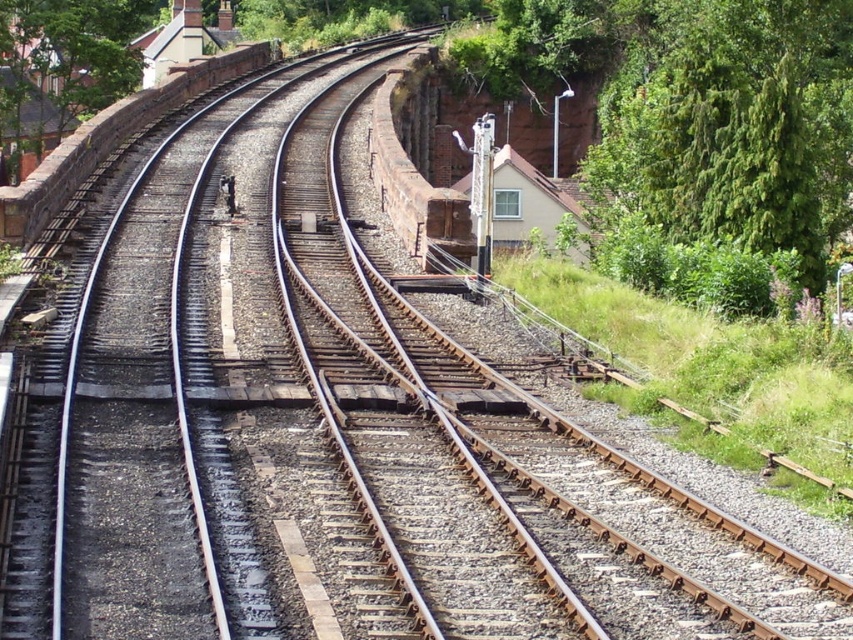
Find the location of a particular element. green leafy tree at right is located at coordinates (730, 124).

Does point (683, 189) come in front of point (80, 4)?

Yes.

Between point (627, 22) and point (0, 108), which one is positioned in front?

Point (0, 108) is in front.

Where is `green leafy tree at right`? This screenshot has height=640, width=853. green leafy tree at right is located at coordinates (730, 124).